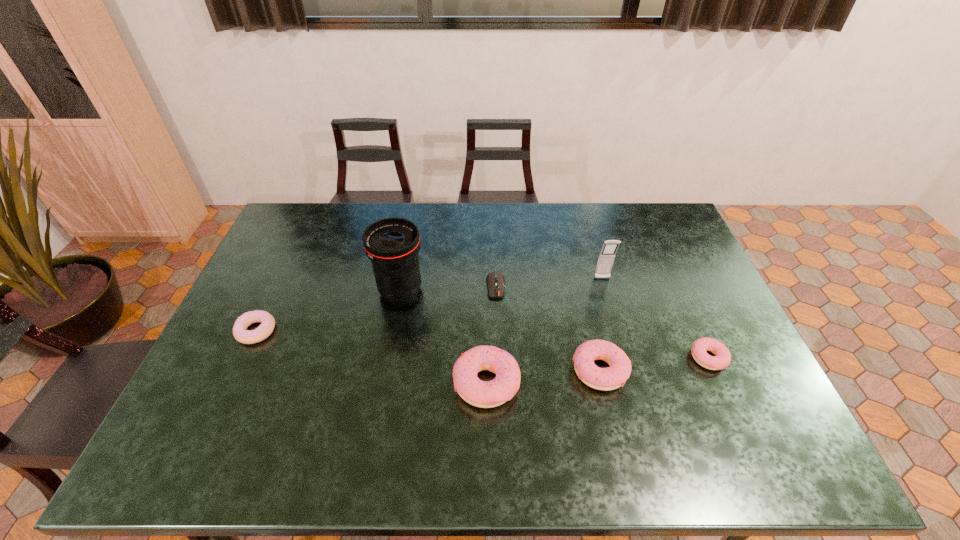
Locate an element on the screen. Image resolution: width=960 pixels, height=540 pixels. the second doughnut from left to right is located at coordinates (485, 394).

The image size is (960, 540). Identify the location of the fourth tallest object. (610, 378).

Locate an element on the screen. the third shortest doughnut is located at coordinates (610, 378).

This screenshot has width=960, height=540. I want to click on the rightmost doughnut, so click(721, 360).

Locate an element on the screen. the rightmost object is located at coordinates (721, 360).

Locate an element on the screen. the second object from left to right is located at coordinates (392, 244).

Locate an element on the screen. the tallest object is located at coordinates (392, 244).

You are a GUI agent. You are given a task and a screenshot of the screen. Output one action in this format:
    pyautogui.click(x=<x>, y=<y>)
    Task: Click on the leftmost doughnut
    
    Given the screenshot: What is the action you would take?
    pyautogui.click(x=267, y=325)

Image resolution: width=960 pixels, height=540 pixels. In order to click on cellular telephone in this screenshot , I will do `click(606, 257)`.

Find the location of a particular element. computer equipment is located at coordinates (495, 280).